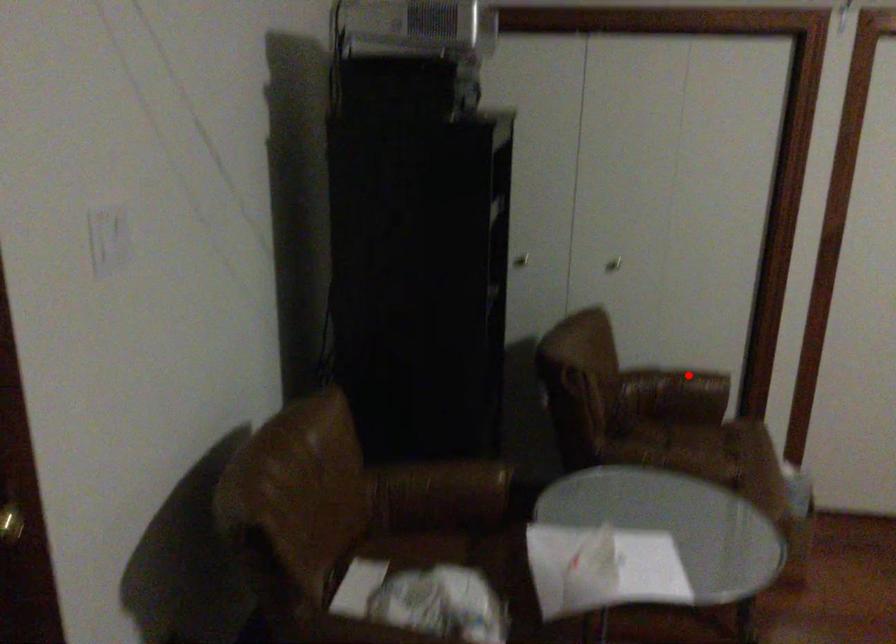
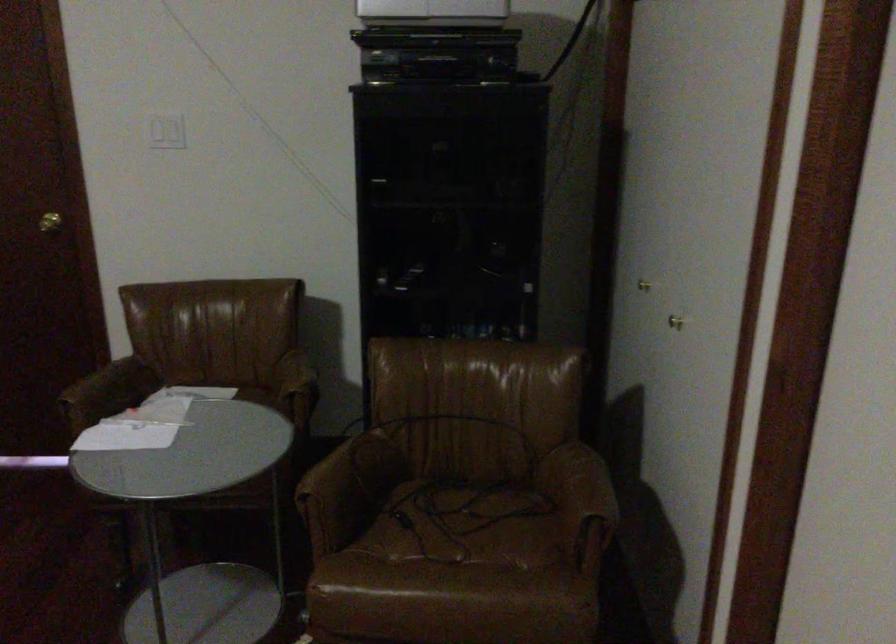
Question: I am providing you with two images of the same scene from different viewpoints. Given a red point in image1, look at the same physical point in image2. Is it:

Choices:
 (A) Closer to the viewpoint
 (B) Farther from the viewpoint

Answer: (A)